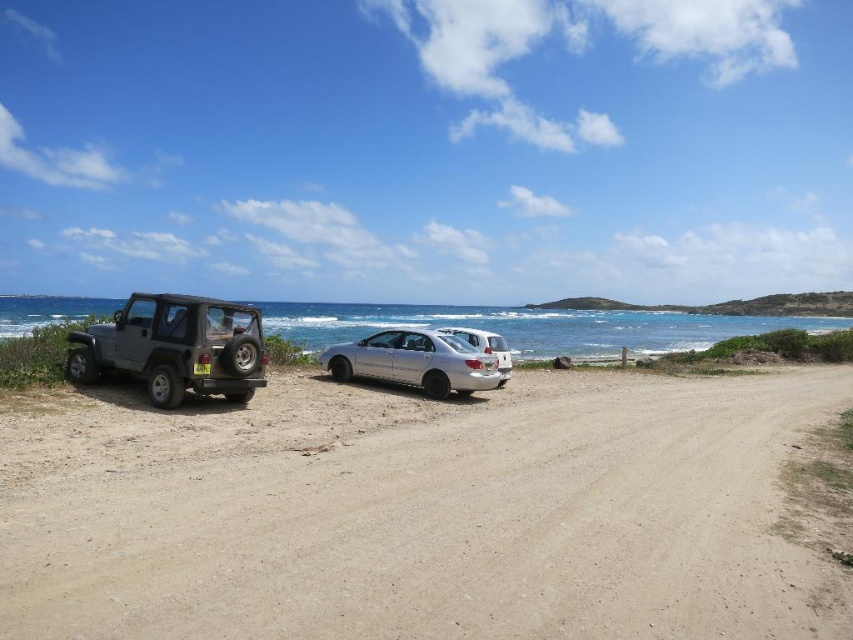
You are planning to load a large camping tent onto the matte black jeep at left and the silver metallic sedan at center. Based on the scene, which vehicle can accommodate the tent due to its height?

The matte black jeep at left is taller than the silver metallic sedan at center, so it can accommodate the large camping tent more easily.

You are a hiker planning to walk from the matte black jeep at left to the satin silver sedan at center. Which direction should you head to reach the sedan?

Since the matte black jeep at left is closer to the viewer than the satin silver sedan at center, you should head towards the center of the image to reach the sedan.